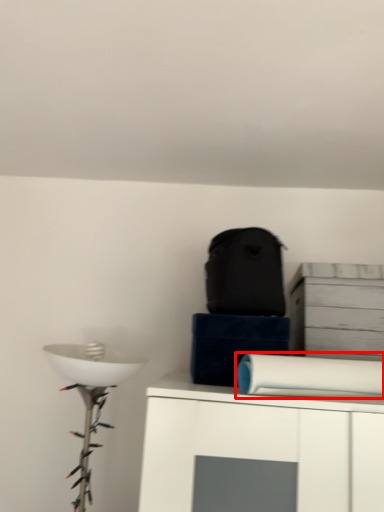
Question: From the image's perspective, where is toilet paper (annotated by the red box) located relative to cabinetry?

Choices:
 (A) below
 (B) above

Answer: (A)